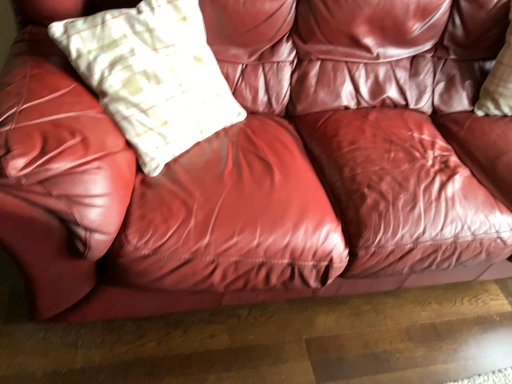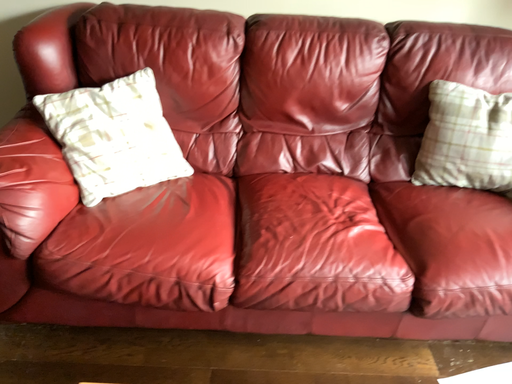
Question: How did the camera likely rotate when shooting the video?

Choices:
 (A) rotated upward
 (B) rotated downward

Answer: (A)